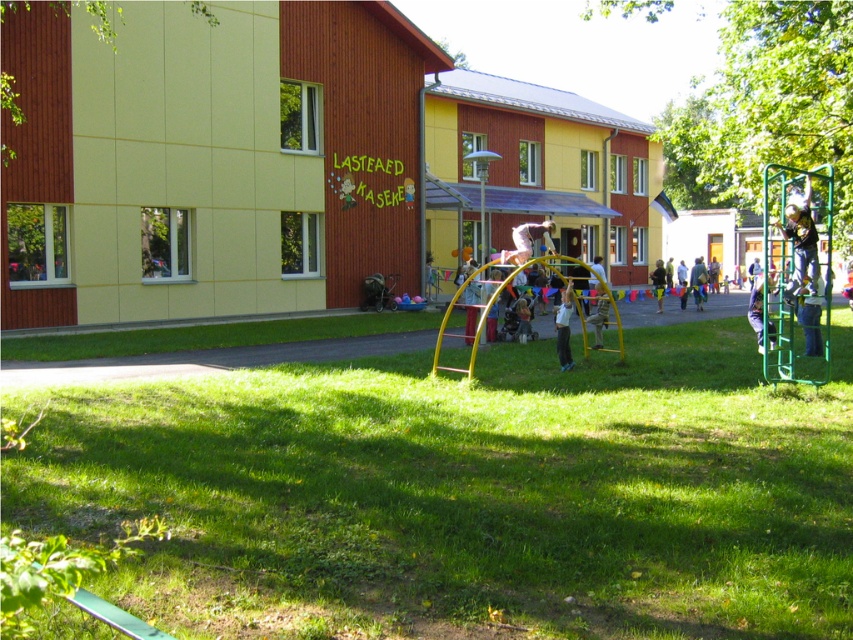
Based on the photo, you are a parent supervising children at the playground. You notice a child wearing yellow shorts at center and another child on the green fabric swing at center. Which child is closer to you?

The yellow shorts at center has a larger size compared to the green fabric swing at center, so the child wearing yellow shorts at center is closer to you.

You are a parent supervising children at the playground. You notice two children wearing light blue denim pants at lower center and yellow shorts at center. Which child is standing higher relative to the other?

The light blue denim pants at lower center is above yellow shorts at center, so the child wearing light blue denim pants at lower center is standing higher than the one in yellow shorts at center.

You are a parent at the playground and see a child with white fluffy hair at upper right and another child wearing light blue fabric pants at center. Which child is higher up in the climbing frame?

The white fluffy hair at upper right is located above the light blue fabric pants at center, so the child with white fluffy hair at upper right is higher up in the climbing frame.